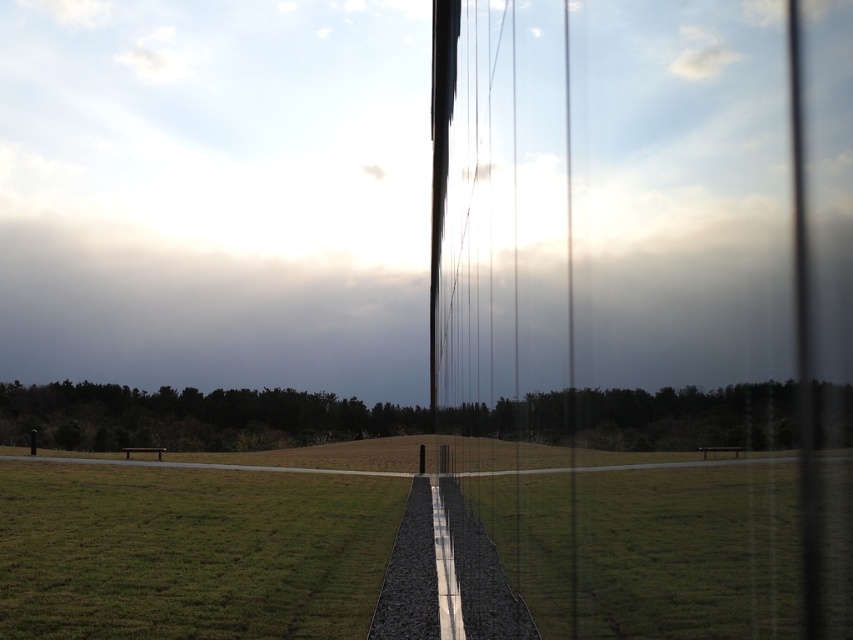
Is green grass at lower left further to the viewer compared to green grass at center?

That is True.

Does green grass at lower left have a greater width compared to green grass at center?

Correct, the width of green grass at lower left exceeds that of green grass at center.

Does point (100, 541) come farther from viewer compared to point (712, 636)?

Yes.

The height and width of the screenshot is (640, 853). What are the coordinates of `green grass at lower left` in the screenshot? It's located at (190, 552).

Can you confirm if transparent glass train window at center is positioned below green grass at lower left?

Actually, transparent glass train window at center is above green grass at lower left.

Is transparent glass train window at center wider than green grass at lower left?

In fact, transparent glass train window at center might be narrower than green grass at lower left.

Between point (770, 320) and point (286, 605), which one is positioned in front?

Point (770, 320)

You are a GUI agent. You are given a task and a screenshot of the screen. Output one action in this format:
    pyautogui.click(x=<x>, y=<y>)
    Task: Click on the transparent glass train window at center
    
    Given the screenshot: What is the action you would take?
    pyautogui.click(x=648, y=304)

The image size is (853, 640). In order to click on transparent glass train window at center in this screenshot , I will do `click(648, 304)`.

Is point (607, 388) positioned before point (791, 557)?

No, (607, 388) is further to viewer.

Between point (683, 404) and point (552, 506), which one is positioned in front?

Positioned in front is point (683, 404).

You are a GUI agent. You are given a task and a screenshot of the screen. Output one action in this format:
    pyautogui.click(x=<x>, y=<y>)
    Task: Click on the transparent glass train window at center
    
    Given the screenshot: What is the action you would take?
    pyautogui.click(x=648, y=304)